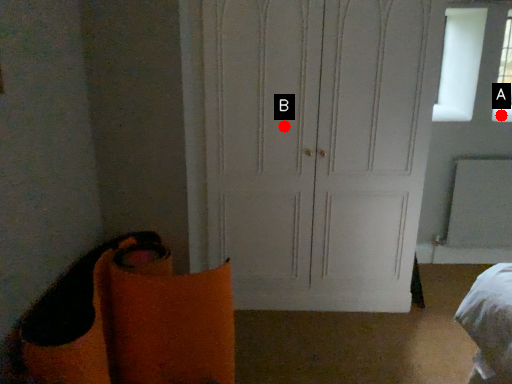
Question: Two points are circled on the image, labeled by A and B beside each circle. Which point appears closest to the camera in this image?

Choices:
 (A) A is closer
 (B) B is closer

Answer: (B)